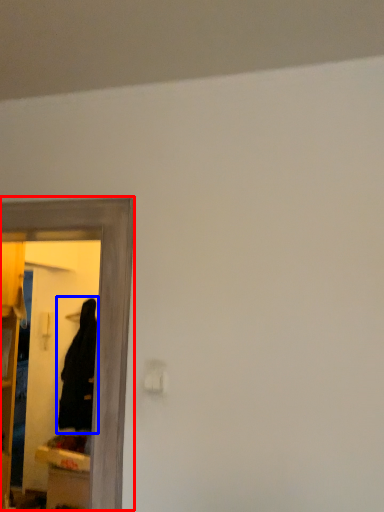
Question: Which object appears closest to the camera in this image, mirror (highlighted by a red box) or robe (highlighted by a blue box)?

Choices:
 (A) mirror
 (B) robe

Answer: (A)